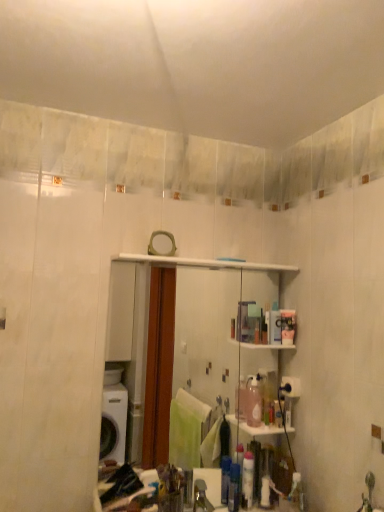
Image resolution: width=384 pixels, height=512 pixels. Describe the element at coordinates (287, 326) in the screenshot. I see `translucent plastic container at upper right` at that location.

Image resolution: width=384 pixels, height=512 pixels. I want to click on translucent plastic container at upper right, so click(287, 326).

From the image's perspective, does metallic silver faucet at lower center appear higher than translucent plastic container at upper right?

Actually, metallic silver faucet at lower center appears below translucent plastic container at upper right in the image.

Image resolution: width=384 pixels, height=512 pixels. Identify the location of faucet that is on the left side of translucent plastic container at upper right. (201, 497).

From a real-world perspective, is metallic silver faucet at lower center under translucent plastic container at upper right?

Correct, in the physical world, metallic silver faucet at lower center is lower than translucent plastic container at upper right.

How many degrees apart are the facing directions of translucent plastic container at upper right and clear glass mirror at center?

translucent plastic container at upper right and clear glass mirror at center are facing 0.0917 degrees away from each other.

From the picture: Does translucent plastic container at upper right have a greater height compared to clear glass mirror at center?

Incorrect, the height of translucent plastic container at upper right is not larger of that of clear glass mirror at center.

From the picture: Which of these two, translucent plastic container at upper right or clear glass mirror at center, is bigger?

→ With larger size is clear glass mirror at center.

Is translucent plastic container at upper right wider or thinner than clear glass mirror at center?

In the image, translucent plastic container at upper right appears to be wider than clear glass mirror at center.

Looking at the image, does clear glass mirror at center seem bigger or smaller compared to translucent plastic container at upper right?

clear glass mirror at center is bigger than translucent plastic container at upper right.

Is clear glass mirror at center facing towards translucent plastic container at upper right?

Yes, clear glass mirror at center is aimed at translucent plastic container at upper right.

How many degrees apart are the facing directions of clear glass mirror at center and translucent plastic container at upper right?

The angular difference between clear glass mirror at center and translucent plastic container at upper right is 0.0917 degrees.

Identify the location of mirror located on the left of translucent plastic container at upper right. This screenshot has height=512, width=384. (203, 265).

Would you say metallic silver faucet at lower center is part of clear glass mirror at center's contents?

No, metallic silver faucet at lower center is located outside of clear glass mirror at center.

Looking at this image, which object is more forward, clear glass mirror at center or metallic silver faucet at lower center?

metallic silver faucet at lower center is more forward.

Who is smaller, clear glass mirror at center or metallic silver faucet at lower center?

metallic silver faucet at lower center is smaller.

Are clear glass mirror at center and metallic silver faucet at lower center far apart?

They are positioned close to each other.

From a real-world perspective, which object rests below the other?

In real-world perspective, metallic silver faucet at lower center is lower.

Is metallic silver faucet at lower center at the back of translucent plastic container at upper right?

translucent plastic container at upper right is not turned away from metallic silver faucet at lower center.

Considering the points (277, 321) and (194, 500), which point is in front, point (277, 321) or point (194, 500)?

Positioned in front is point (194, 500).

Which is in front, translucent plastic container at upper right or metallic silver faucet at lower center?

metallic silver faucet at lower center.

I want to click on faucet lying on the right of clear glass mirror at center, so click(201, 497).

Is metallic silver faucet at lower center far away from clear glass mirror at center?

No, there isn't a large distance between metallic silver faucet at lower center and clear glass mirror at center.

From the image's perspective, does metallic silver faucet at lower center appear lower than clear glass mirror at center?

Yes, from the image's perspective, metallic silver faucet at lower center is below clear glass mirror at center.

Locate an element on the screen. This screenshot has height=512, width=384. faucet below the translucent plastic container at upper right (from the image's perspective) is located at coordinates (201, 497).

The height and width of the screenshot is (512, 384). Identify the location of mirror below the translucent plastic container at upper right (from a real-world perspective). (203, 265).

Estimate the real-world distances between objects in this image. Which object is closer to clear glass mirror at center, translucent plastic container at upper right or metallic silver faucet at lower center?

The object closer to clear glass mirror at center is translucent plastic container at upper right.

Looking at the image, which one is located closer to clear glass mirror at center, metallic silver faucet at lower center or translucent plastic container at upper right?

Based on the image, translucent plastic container at upper right appears to be nearer to clear glass mirror at center.

Estimate the real-world distances between objects in this image. Which object is further from metallic silver faucet at lower center, clear glass mirror at center or translucent plastic container at upper right?

clear glass mirror at center is further to metallic silver faucet at lower center.

Which object lies further to the anchor point translucent plastic container at upper right, clear glass mirror at center or metallic silver faucet at lower center?

metallic silver faucet at lower center lies further to translucent plastic container at upper right than the other object.

Based on their spatial positions, is translucent plastic container at upper right or clear glass mirror at center further from metallic silver faucet at lower center?

clear glass mirror at center.

When comparing their distances from translucent plastic container at upper right, does metallic silver faucet at lower center or clear glass mirror at center seem closer?

The object closer to translucent plastic container at upper right is clear glass mirror at center.

Identify the location of mirror between translucent plastic container at upper right and metallic silver faucet at lower center in the vertical direction. (203, 265).